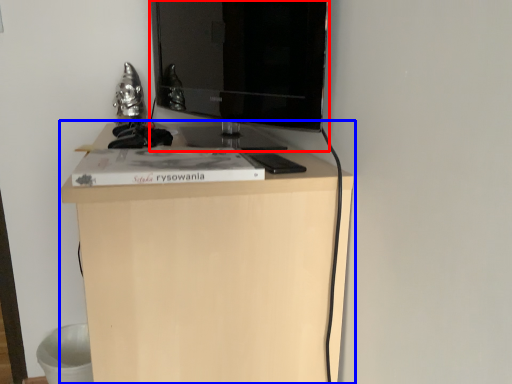
Question: Which object appears closest to the camera in this image, television (highlighted by a red box) or furniture (highlighted by a blue box)?

Choices:
 (A) television
 (B) furniture

Answer: (B)